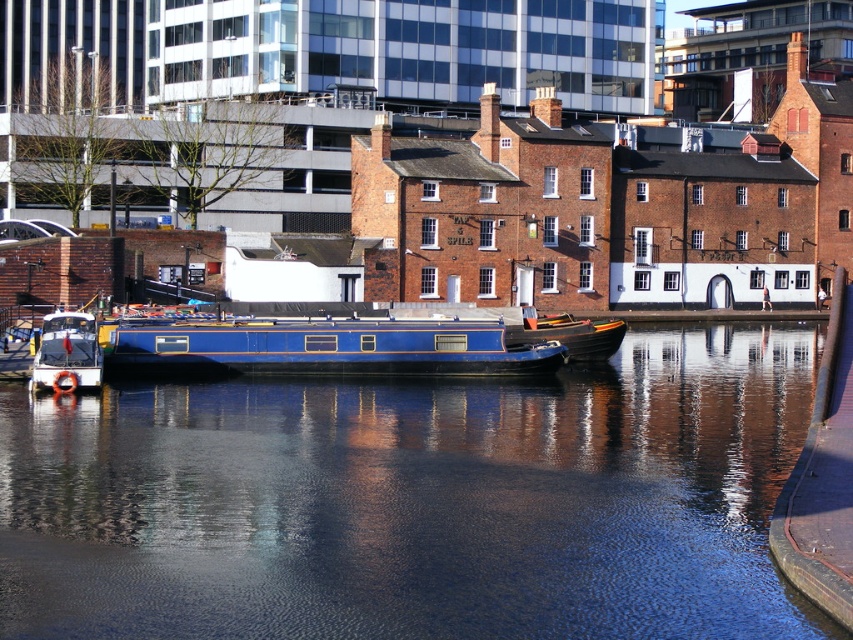
Does point (416, 339) come behind point (598, 326)?

No, (416, 339) is in front of (598, 326).

Can you confirm if blue polished wood barge at center is shorter than wooden boat at center?

Yes, blue polished wood barge at center is shorter than wooden boat at center.

Which is behind, point (357, 326) or point (549, 330)?

The point (549, 330) is more distant.

The height and width of the screenshot is (640, 853). Find the location of `blue polished wood barge at center`. blue polished wood barge at center is located at coordinates (321, 346).

Does white glossy boat at left come behind wooden boat at center?

No, it is not.

Can you confirm if white glossy boat at left is wider than wooden boat at center?

In fact, white glossy boat at left might be narrower than wooden boat at center.

Is point (80, 332) in front of point (587, 324)?

Yes, point (80, 332) is in front of point (587, 324).

The image size is (853, 640). Identify the location of white glossy boat at left. (67, 353).

Can you confirm if blue water at center is shorter than wooden boat at center?

Yes, blue water at center is shorter than wooden boat at center.

Between blue water at center and wooden boat at center, which one appears on the left side from the viewer's perspective?

blue water at center is more to the left.

Find the location of a particular element. The image size is (853, 640). blue water at center is located at coordinates (416, 500).